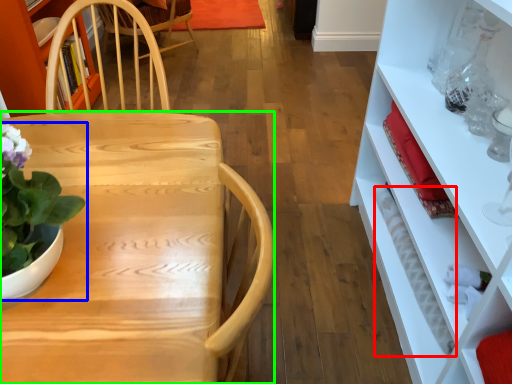
Question: Estimate the real-world distances between objects in this image. Which object is farther from bottle (highlighted by a red box), houseplant (highlighted by a blue box) or desk (highlighted by a green box)?

Choices:
 (A) houseplant
 (B) desk

Answer: (A)